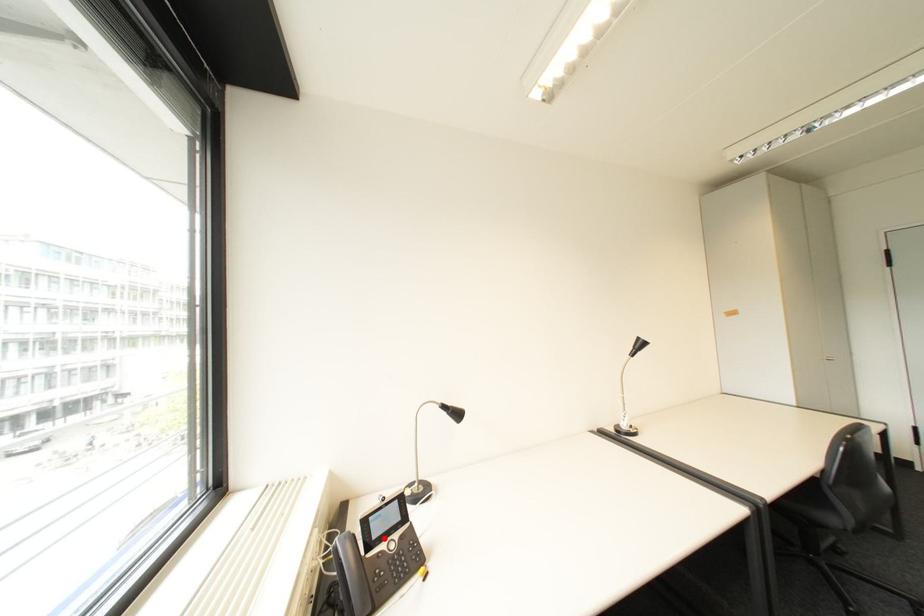
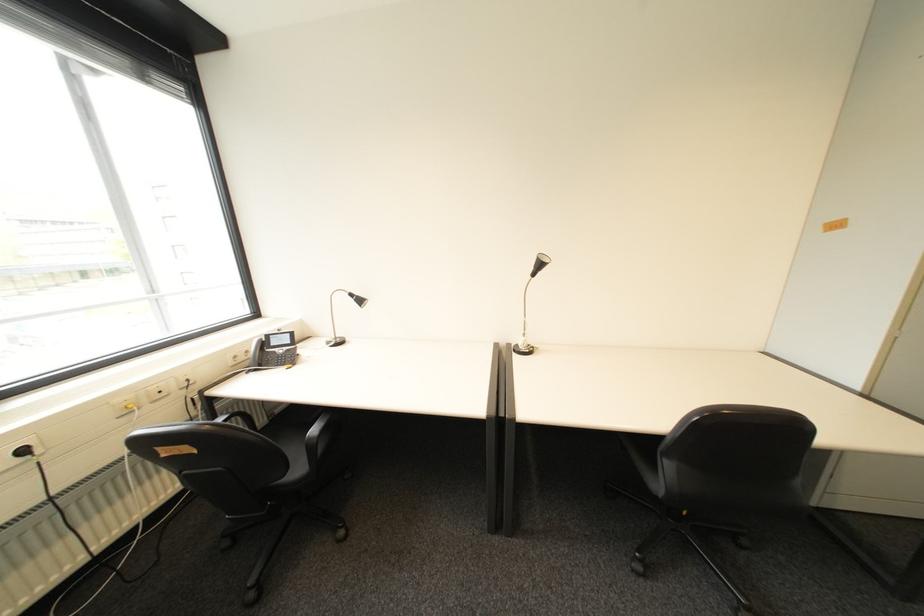
Question: I am providing you with two images of the same scene from different viewpoints. A red point is marked on the first image. At the location where the point appears in image 1, is it still visible in image 2?

Choices:
 (A) Yes
 (B) No

Answer: (A)